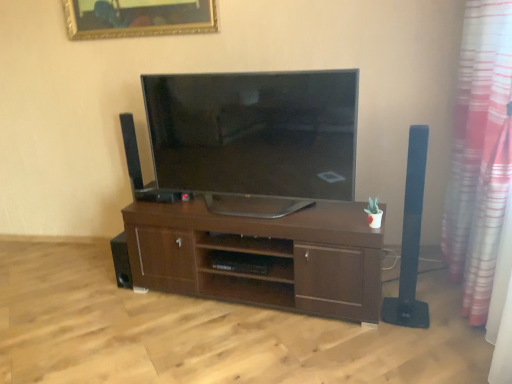
Question: From their relative heights in the image, would you say satin black tv at center is taller or shorter than black matte speaker at right, which is the 3th speaker in back-to-front order?

Choices:
 (A) tall
 (B) short

Answer: (B)

Question: Is satin black tv at center to the left or to the right of black matte speaker at right, which is the first speaker in front-to-back order, in the image?

Choices:
 (A) left
 (B) right

Answer: (A)

Question: Estimate the real-world distances between objects in this image. Which object is farther from the black matte speaker at right, marked as the 1th speaker in a right-to-left arrangement?

Choices:
 (A) pink striped curtain at right
 (B) gold-framed mirror at upper center
 (C) black matte speaker at lower left, positioned as the second speaker in back-to-front order
 (D) brown wood shelf at center
 (E) satin black tv at center

Answer: (B)

Question: Considering the real-world distances, which object is farthest from the gold-framed mirror at upper center?

Choices:
 (A) pink striped curtain at right
 (B) satin black tv at center
 (C) black matte speaker at lower left, positioned as the second speaker in back-to-front order
 (D) black matte speaker at left, which is the first speaker in back-to-front order
 (E) brown wood shelf at center

Answer: (A)